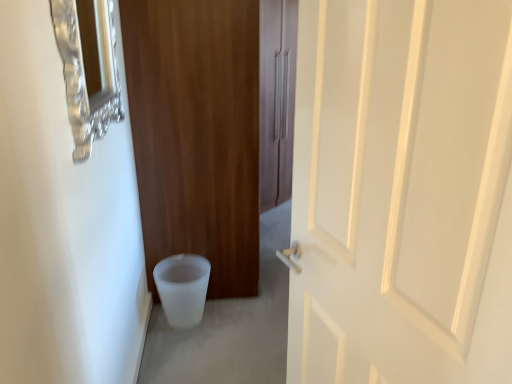
What do you see at coordinates (402, 193) in the screenshot? The width and height of the screenshot is (512, 384). I see `white matte door at center, which is the 2th door from back to front` at bounding box center [402, 193].

Measure the distance between brushed metal medicine cabinet at upper left and camera.

brushed metal medicine cabinet at upper left and camera are 3.47 feet apart.

Identify the location of white matte door at center, the 1th door from the front. (402, 193).

Considering the sizes of white frosted toilet bowl at lower left and matte wood door at center, acting as the first door starting from the back, in the image, is white frosted toilet bowl at lower left taller or shorter than matte wood door at center, acting as the first door starting from the back,?

white frosted toilet bowl at lower left is shorter than matte wood door at center, acting as the first door starting from the back.

Does white frosted toilet bowl at lower left have a lesser width compared to matte wood door at center, acting as the first door starting from the back?

Indeed, white frosted toilet bowl at lower left has a lesser width compared to matte wood door at center, acting as the first door starting from the back.

How many degrees apart are the facing directions of white frosted toilet bowl at lower left and matte wood door at center, acting as the first door starting from the back?

The angle between the facing direction of white frosted toilet bowl at lower left and the facing direction of matte wood door at center, acting as the first door starting from the back, is 1.98 degrees.

Relative to matte wood door at center, acting as the first door starting from the back, is white frosted toilet bowl at lower left in front or behind?

Clearly, white frosted toilet bowl at lower left is behind matte wood door at center, acting as the first door starting from the back.

From a real-world perspective, is white matte door at center, which is the 2th door from back to front, located higher than white frosted toilet bowl at lower left?

Yes.

Does white matte door at center, the 1th door from the front, turn towards white frosted toilet bowl at lower left?

No, white matte door at center, the 1th door from the front, is not oriented towards white frosted toilet bowl at lower left.

Considering the relative positions of white matte door at center, the 1th door from the front, and white frosted toilet bowl at lower left in the image provided, is white matte door at center, the 1th door from the front, to the right of white frosted toilet bowl at lower left from the viewer's perspective?

Yes.

Where is `the 2nd door to the right when counting from the white frosted toilet bowl at lower left`? The image size is (512, 384). the 2nd door to the right when counting from the white frosted toilet bowl at lower left is located at coordinates (402, 193).

Which is more to the right, white matte door at center, the 1th door from the front, or brushed metal medicine cabinet at upper left?

white matte door at center, the 1th door from the front, is more to the right.

Is point (482, 239) closer to camera compared to point (92, 75)?

Yes, it is in front of point (92, 75).

What's the angular difference between white matte door at center, which is the 2th door from back to front, and brushed metal medicine cabinet at upper left's facing directions?

165 degrees separate the facing orientations of white matte door at center, which is the 2th door from back to front, and brushed metal medicine cabinet at upper left.

Considering the sizes of objects white matte door at center, which is the 2th door from back to front, and brushed metal medicine cabinet at upper left in the image provided, who is wider, white matte door at center, which is the 2th door from back to front, or brushed metal medicine cabinet at upper left?

white matte door at center, which is the 2th door from back to front.

Relative to matte wood door at center, acting as the first door starting from the back, is white matte door at center, the 1th door from the front, in front or behind?

Clearly, white matte door at center, the 1th door from the front, is in front of matte wood door at center, acting as the first door starting from the back.

Considering the sizes of white matte door at center, which is the 2th door from back to front, and matte wood door at center, acting as the first door starting from the back, in the image, is white matte door at center, which is the 2th door from back to front, bigger or smaller than matte wood door at center, acting as the first door starting from the back,?

Considering their sizes, white matte door at center, which is the 2th door from back to front, takes up less space than matte wood door at center, acting as the first door starting from the back.

From the image's perspective, is white matte door at center, the 1th door from the front, above matte wood door at center, acting as the first door starting from the back?

No, from the image's perspective, white matte door at center, the 1th door from the front, is not above matte wood door at center, acting as the first door starting from the back.

From a real-world perspective, is matte wood door at center, acting as the second door starting from the front, above or below white frosted toilet bowl at lower left?

matte wood door at center, acting as the second door starting from the front, is above white frosted toilet bowl at lower left.

Is matte wood door at center, acting as the second door starting from the front, facing away from white frosted toilet bowl at lower left?

matte wood door at center, acting as the second door starting from the front, does not have its back to white frosted toilet bowl at lower left.

Does matte wood door at center, acting as the first door starting from the back, have a smaller size compared to white frosted toilet bowl at lower left?

No, matte wood door at center, acting as the first door starting from the back, is not smaller than white frosted toilet bowl at lower left.

Would you say matte wood door at center, acting as the second door starting from the front, is inside or outside white frosted toilet bowl at lower left?

matte wood door at center, acting as the second door starting from the front, is not enclosed by white frosted toilet bowl at lower left.

Where is `toilet bowl below the white matte door at center, which is the 2th door from back to front (from the image's perspective)`? toilet bowl below the white matte door at center, which is the 2th door from back to front (from the image's perspective) is located at coordinates (182, 288).

Is white frosted toilet bowl at lower left positioned in front of white matte door at center, which is the 2th door from back to front?

That is False.

From the image's perspective, which one is positioned higher, white frosted toilet bowl at lower left or white matte door at center, the 1th door from the front?

white matte door at center, the 1th door from the front.

Looking at this image, can you confirm if white frosted toilet bowl at lower left is positioned to the right of white matte door at center, the 1th door from the front?

Incorrect, white frosted toilet bowl at lower left is not on the right side of white matte door at center, the 1th door from the front.

Is brushed metal medicine cabinet at upper left with white matte door at center, the 1th door from the front?

They are not placed beside each other.

Is brushed metal medicine cabinet at upper left oriented away from white matte door at center, which is the 2th door from back to front?

No, white matte door at center, which is the 2th door from back to front, is not at the back of brushed metal medicine cabinet at upper left.

At what (x,y) coordinates should I click in order to perform the action: click on door in front of the brushed metal medicine cabinet at upper left. Please return your answer as a coordinate pair (x, y). Looking at the image, I should click on (402, 193).

From a real-world perspective, is brushed metal medicine cabinet at upper left on white matte door at center, which is the 2th door from back to front?

Yes.

What are the coordinates of `toilet bowl on the left of the matte wood door at center, acting as the second door starting from the front` in the screenshot? It's located at (182, 288).

From a real-world perspective, starting from the white frosted toilet bowl at lower left, which door is the 2nd one vertically above it? Please provide its 2D coordinates.

[(402, 193)]

Estimate the real-world distances between objects in this image. Which object is further from white frosted toilet bowl at lower left, white matte door at center, the 1th door from the front, or brushed metal medicine cabinet at upper left?

white matte door at center, the 1th door from the front, lies further to white frosted toilet bowl at lower left than the other object.

Which object lies nearer to the anchor point matte wood door at center, acting as the first door starting from the back, white matte door at center, which is the 2th door from back to front, or white frosted toilet bowl at lower left?

white frosted toilet bowl at lower left lies closer to matte wood door at center, acting as the first door starting from the back, than the other object.

Estimate the real-world distances between objects in this image. Which object is closer to white frosted toilet bowl at lower left, brushed metal medicine cabinet at upper left or white matte door at center, the 1th door from the front?

Among the two, brushed metal medicine cabinet at upper left is located nearer to white frosted toilet bowl at lower left.

Based on their spatial positions, is brushed metal medicine cabinet at upper left or matte wood door at center, acting as the first door starting from the back, closer to white matte door at center, the 1th door from the front?

brushed metal medicine cabinet at upper left is positioned closer to the anchor white matte door at center, the 1th door from the front.

Based on their spatial positions, is matte wood door at center, acting as the first door starting from the back, or brushed metal medicine cabinet at upper left further from white frosted toilet bowl at lower left?

brushed metal medicine cabinet at upper left is positioned further to the anchor white frosted toilet bowl at lower left.

When comparing their distances from white matte door at center, which is the 2th door from back to front, does matte wood door at center, acting as the second door starting from the front, or white frosted toilet bowl at lower left seem closer?

The object closer to white matte door at center, which is the 2th door from back to front, is matte wood door at center, acting as the second door starting from the front.

Considering their positions, is white matte door at center, which is the 2th door from back to front, positioned closer to matte wood door at center, acting as the second door starting from the front, than brushed metal medicine cabinet at upper left?

brushed metal medicine cabinet at upper left lies closer to matte wood door at center, acting as the second door starting from the front, than the other object.

Considering their positions, is white frosted toilet bowl at lower left positioned closer to white matte door at center, which is the 2th door from back to front, than matte wood door at center, acting as the first door starting from the back?

matte wood door at center, acting as the first door starting from the back, lies closer to white matte door at center, which is the 2th door from back to front, than the other object.

Identify the location of medicine cabinet between white matte door at center, which is the 2th door from back to front, and white frosted toilet bowl at lower left in the front-back direction. The width and height of the screenshot is (512, 384). (88, 69).

Identify the location of medicine cabinet that lies between matte wood door at center, acting as the second door starting from the front, and white frosted toilet bowl at lower left from top to bottom. The width and height of the screenshot is (512, 384). click(x=88, y=69).

You are a GUI agent. You are given a task and a screenshot of the screen. Output one action in this format:
    pyautogui.click(x=<x>, y=<y>)
    Task: Click on the door between white matte door at center, which is the 2th door from back to front, and white frosted toilet bowl at lower left, along the z-axis
    
    Given the screenshot: What is the action you would take?
    pyautogui.click(x=196, y=133)

Identify the location of medicine cabinet positioned between white matte door at center, the 1th door from the front, and matte wood door at center, acting as the second door starting from the front, from near to far. Image resolution: width=512 pixels, height=384 pixels. (88, 69).